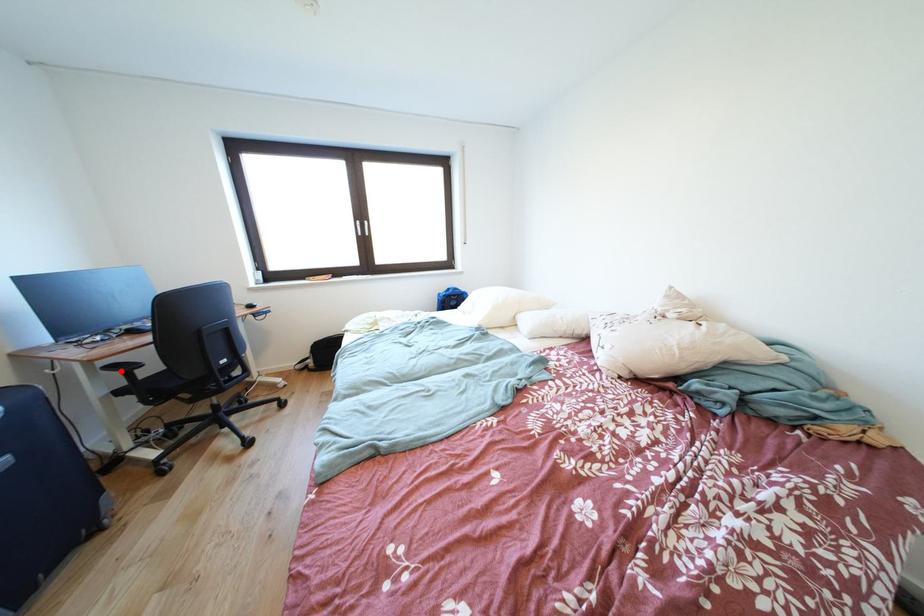
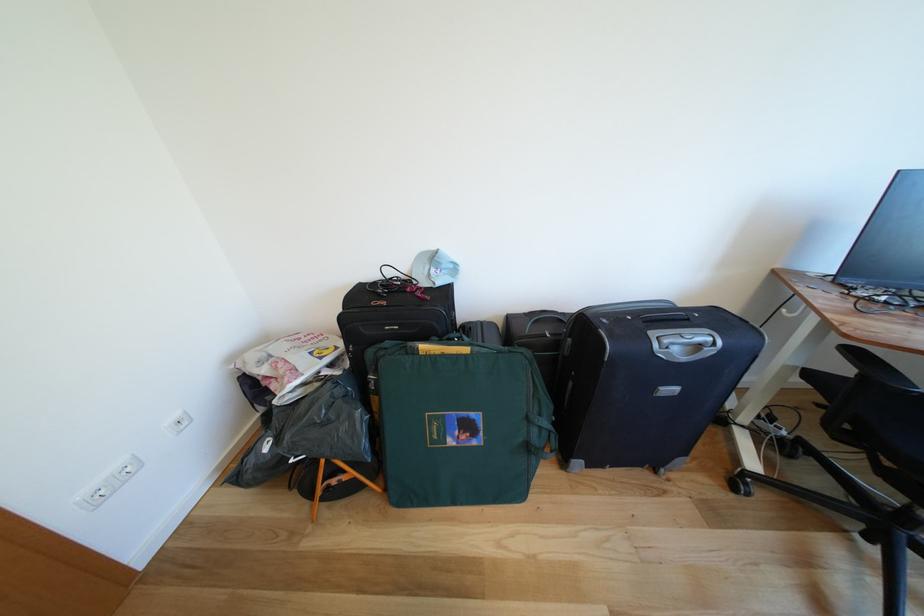
Question: I am providing you with two images of the same scene from different viewpoints. A red point is shown in image1. For the corresponding object point in image2, is it positioned nearer or farther from the camera?

Choices:
 (A) Nearer
 (B) Farther

Answer: (B)